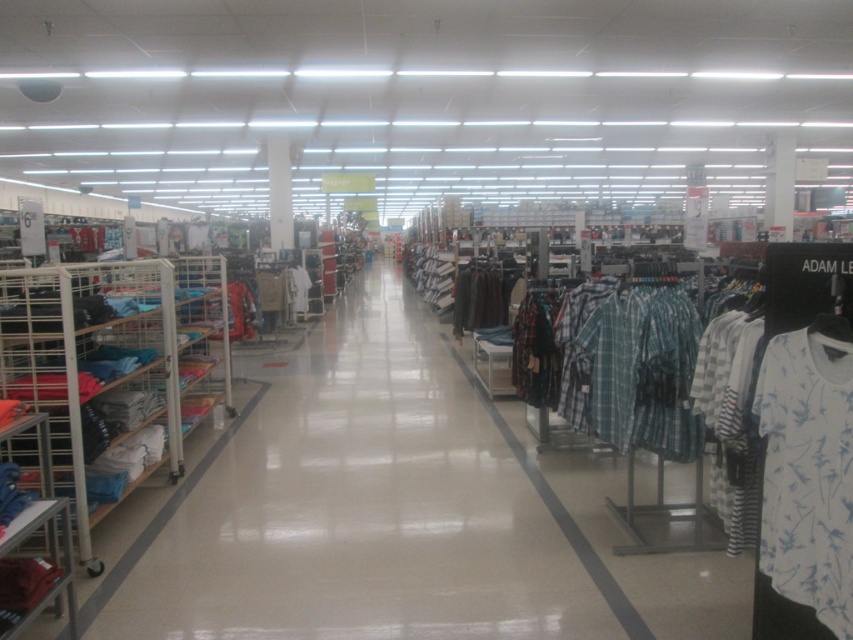
You are a store employee who needs to restock the matte blue shirts at center. The blue fabric shelf at left has a loading height of 1.2 meters. Can you reach the shelf from the shirts without moving them?

The matte blue shirts at center are 1.17 meters away from the blue fabric shelf at left. Since the distance is less than the 1.2 meter loading height, you can reach the shelf from the shirts without moving them.